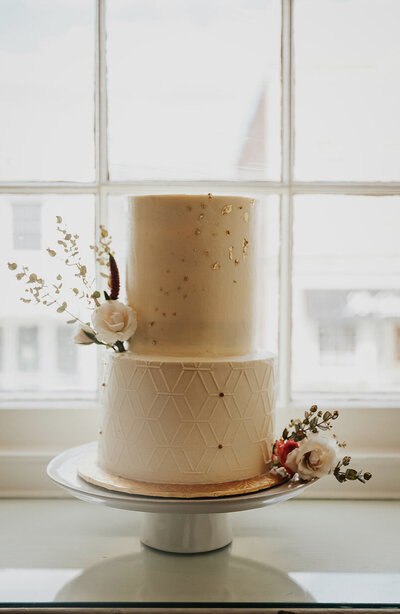
Locate an element on the screen. The image size is (400, 614). reflection of cake stand is located at coordinates (181, 589).